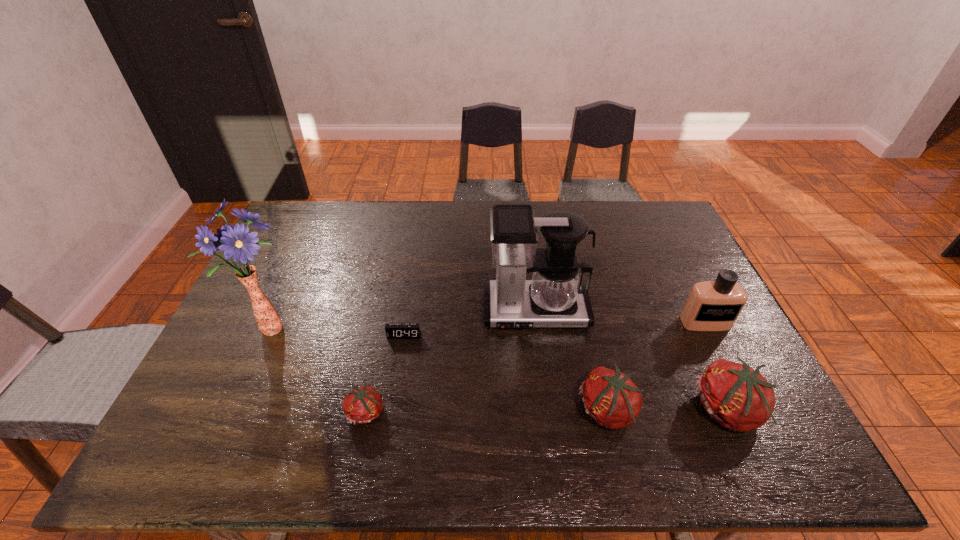
This screenshot has width=960, height=540. Identify the location of the leftmost tomato. (363, 404).

Locate an element on the screen. Image resolution: width=960 pixels, height=540 pixels. the shortest tomato is located at coordinates (x=363, y=404).

The image size is (960, 540). Find the location of `the second shortest tomato`. the second shortest tomato is located at coordinates (610, 397).

Locate an element on the screen. The image size is (960, 540). the third shortest object is located at coordinates (610, 397).

Find the location of a particular element. the rightmost tomato is located at coordinates (738, 397).

You are a GUI agent. You are given a task and a screenshot of the screen. Output one action in this format:
    pyautogui.click(x=<x>, y=<y>)
    Task: Click on the second tallest object
    The height and width of the screenshot is (540, 960).
    Given the screenshot: What is the action you would take?
    pyautogui.click(x=556, y=296)

You are a GUI agent. You are given a task and a screenshot of the screen. Output one action in this format:
    pyautogui.click(x=<x>, y=<y>)
    Task: Click on the tallest object
    This screenshot has width=960, height=540.
    Given the screenshot: What is the action you would take?
    pyautogui.click(x=235, y=241)

Locate an element on the screen. Image resolution: width=960 pixels, height=540 pixels. the leftmost object is located at coordinates (235, 241).

Identify the location of alarm clock. Image resolution: width=960 pixels, height=540 pixels. (393, 331).

Find the location of a particular element. The image size is (960, 540). the fifth shortest object is located at coordinates click(711, 305).